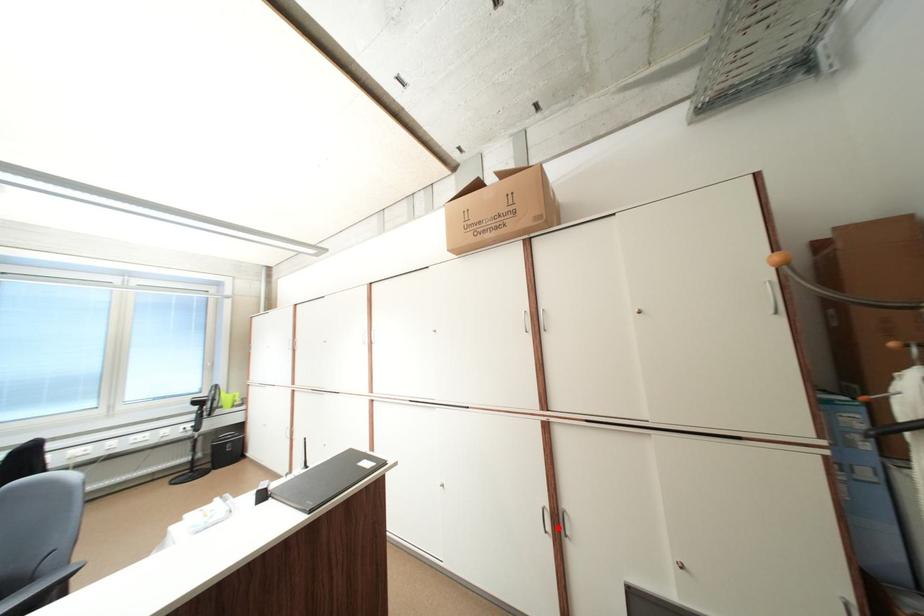
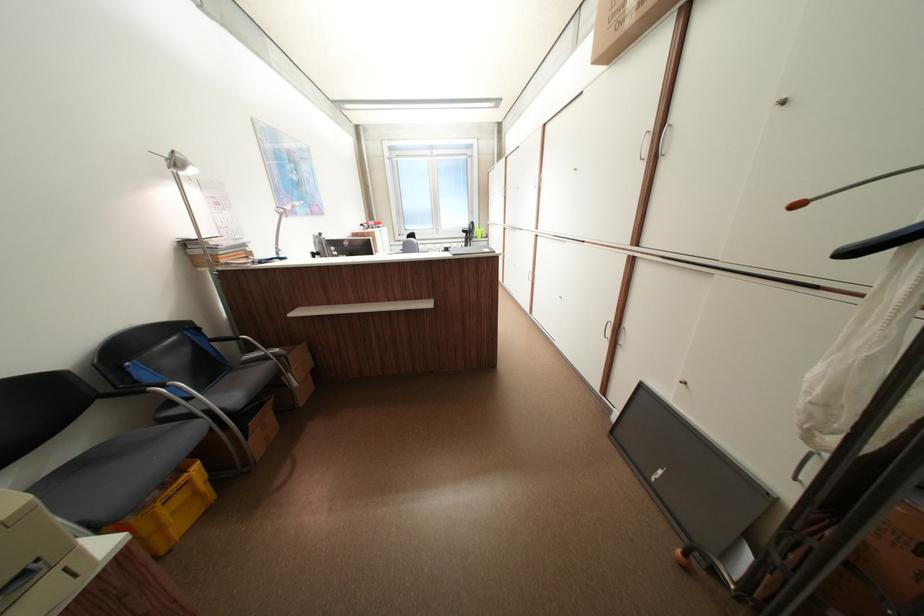
Locate, in the second image, the point that corresponds to the highlighted location in the first image.

(618, 336)